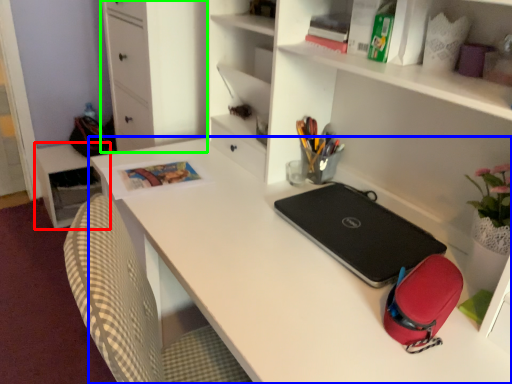
Question: Based on their relative distances, which object is nearer to table (highlighted by a red box)? Choose from desk (highlighted by a blue box) and file cabinet (highlighted by a green box).

Choices:
 (A) desk
 (B) file cabinet

Answer: (B)